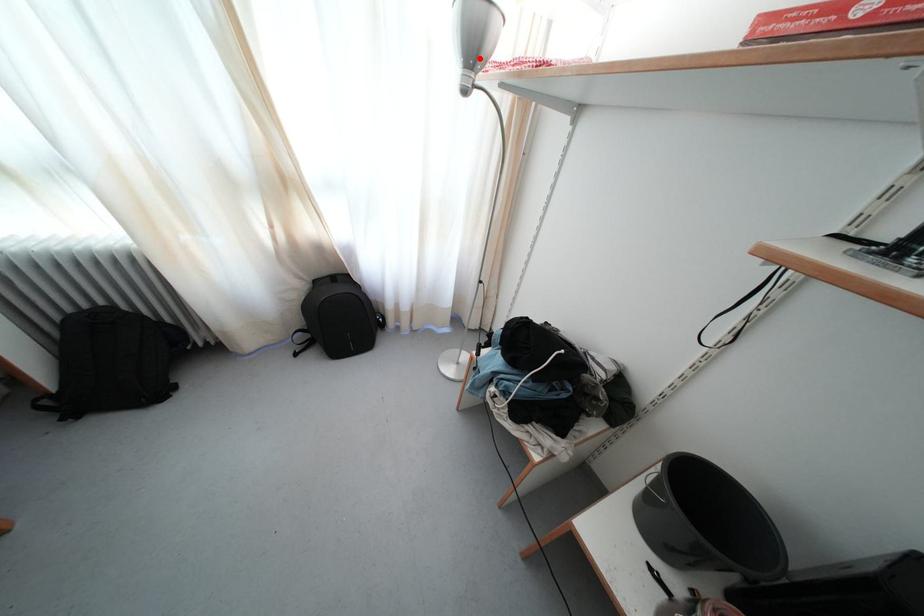
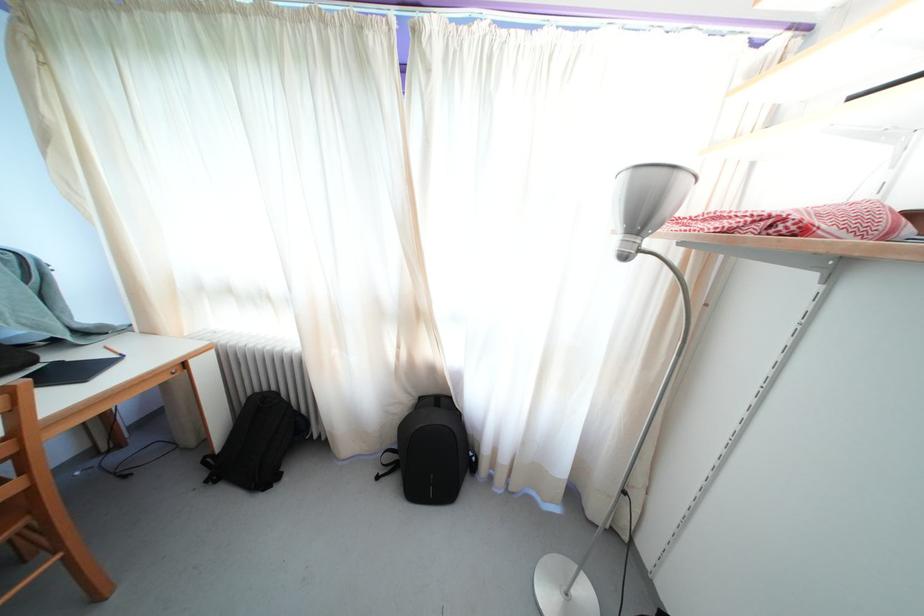
Find the pixel in the second image that matches the highlighted location in the first image.

(648, 223)